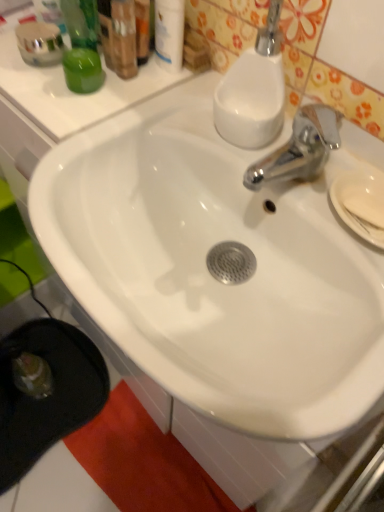
The image size is (384, 512). In order to click on vacant region in front of green matte jar at upper left in this screenshot , I will do `click(77, 124)`.